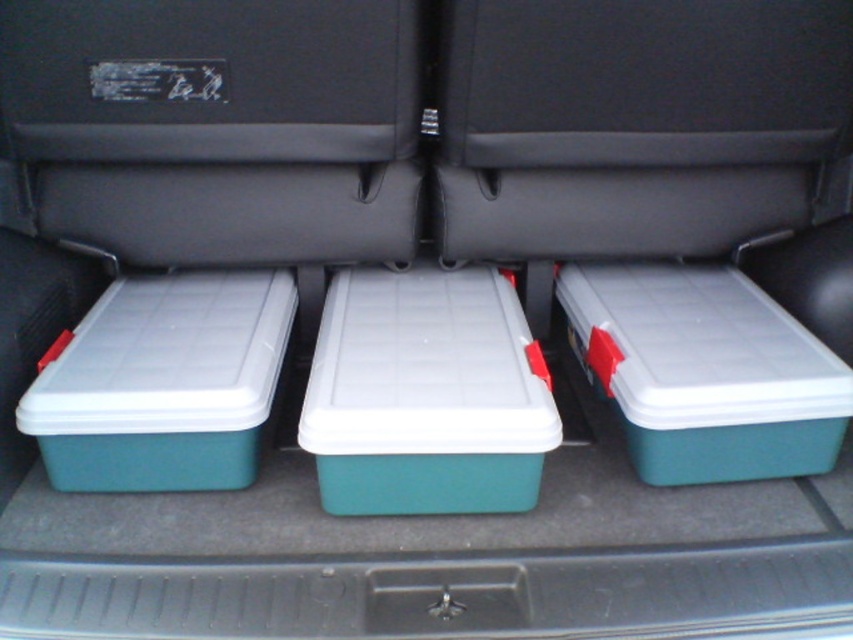
Question: Is teal plastic storage box at right to the left of green plastic storage box at left from the viewer's perspective?

Choices:
 (A) yes
 (B) no

Answer: (B)

Question: Which is farther from the green plastic container at center?

Choices:
 (A) teal plastic storage box at center
 (B) teal plastic storage box at right
 (C) green plastic storage box at left

Answer: (C)

Question: Estimate the real-world distances between objects in this image. Which object is farther from the green plastic container at center?

Choices:
 (A) teal plastic storage box at center
 (B) teal plastic storage box at right

Answer: (A)

Question: Does teal plastic storage box at center appear on the left side of teal plastic storage box at right?

Choices:
 (A) yes
 (B) no

Answer: (A)

Question: Based on their relative distances, which object is nearer to the teal plastic storage box at right?

Choices:
 (A) green plastic container at center
 (B) green plastic storage box at left

Answer: (A)

Question: Does green plastic container at center appear under green plastic storage box at left?

Choices:
 (A) no
 (B) yes

Answer: (A)